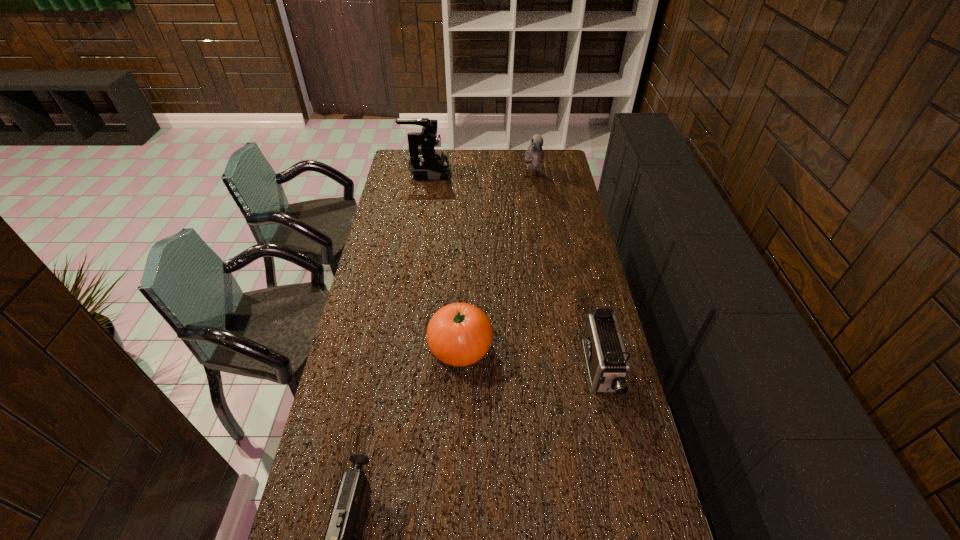
This screenshot has width=960, height=540. What are the coordinates of `the farthest camcorder` in the screenshot? It's located at (427, 161).

Where is `the second object from right to left`? the second object from right to left is located at coordinates (534, 155).

Locate an element on the screen. The height and width of the screenshot is (540, 960). the rightmost object is located at coordinates (607, 361).

I want to click on the second farthest camcorder, so (607, 361).

The image size is (960, 540). What are the coordinates of `pumpkin` in the screenshot? It's located at (459, 334).

The width and height of the screenshot is (960, 540). I want to click on vacant space located 0.230m on the lens mount of the farthest camcorder, so click(x=494, y=173).

Find the location of a particular element. vacant space located 0.290m on the front-facing side of the second object from right to left is located at coordinates [x=540, y=227].

Image resolution: width=960 pixels, height=540 pixels. Identify the location of vacant space located 0.210m at the lens of the rightmost object. (625, 477).

This screenshot has height=540, width=960. I want to click on free spot located 0.380m on the back of the pumpkin, so click(464, 252).

The height and width of the screenshot is (540, 960). Identify the location of camcorder located at the far edge. (427, 161).